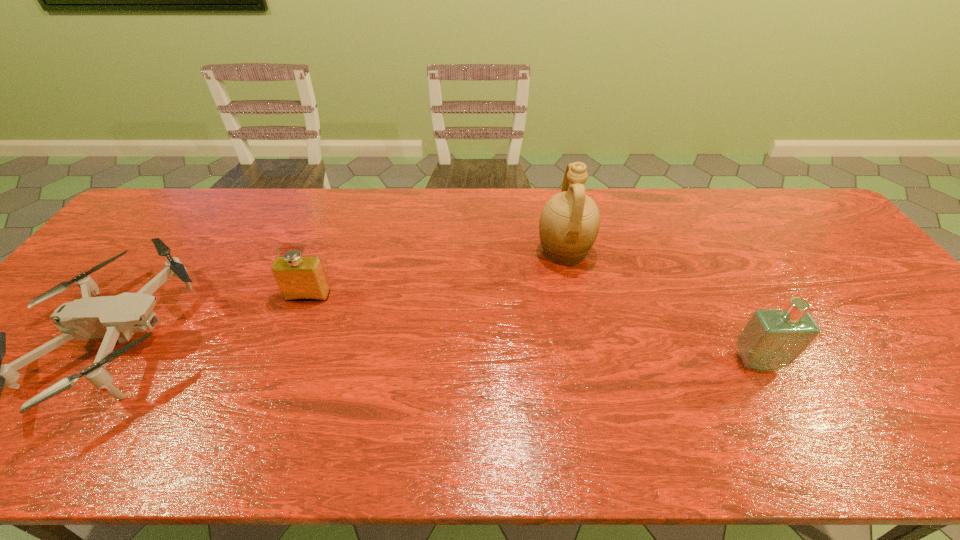
Where is `free space between the shorter perfume and the nearer perfume`? free space between the shorter perfume and the nearer perfume is located at coordinates (533, 328).

I want to click on free space between the second object from right to left and the second object from left to right, so [436, 274].

Identify the location of vacant area between the farther perfume and the third shortest object. (533, 328).

Find the location of a particular element. object that stands as the second closest to the second tallest object is located at coordinates (299, 278).

What are the coordinates of `object identified as the closest to the tallest object` in the screenshot? It's located at (772, 339).